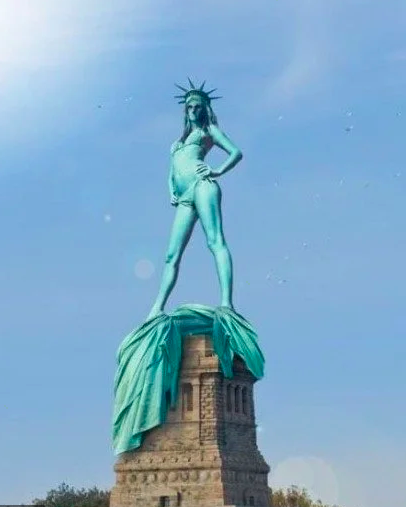
Where is `windows`? This screenshot has width=406, height=507. windows is located at coordinates (190, 402), (228, 398), (237, 399), (247, 398).